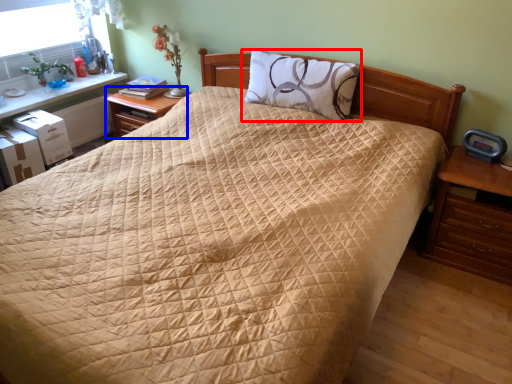
Question: Which object appears farthest to the camera in this image, pillow (highlighted by a red box) or nightstand (highlighted by a blue box)?

Choices:
 (A) pillow
 (B) nightstand

Answer: (B)